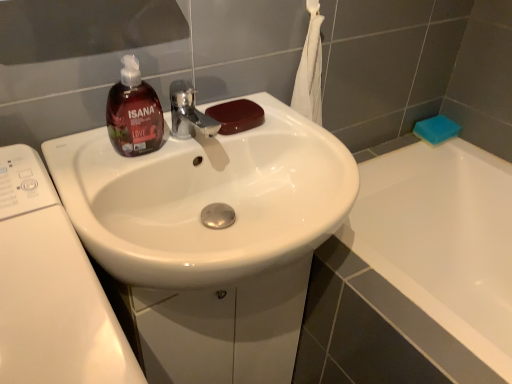
Where is `vacant point to the right of brown glossy soap at sink, arranged as the 2th soap when viewed from the right`? This screenshot has height=384, width=512. vacant point to the right of brown glossy soap at sink, arranged as the 2th soap when viewed from the right is located at coordinates (298, 136).